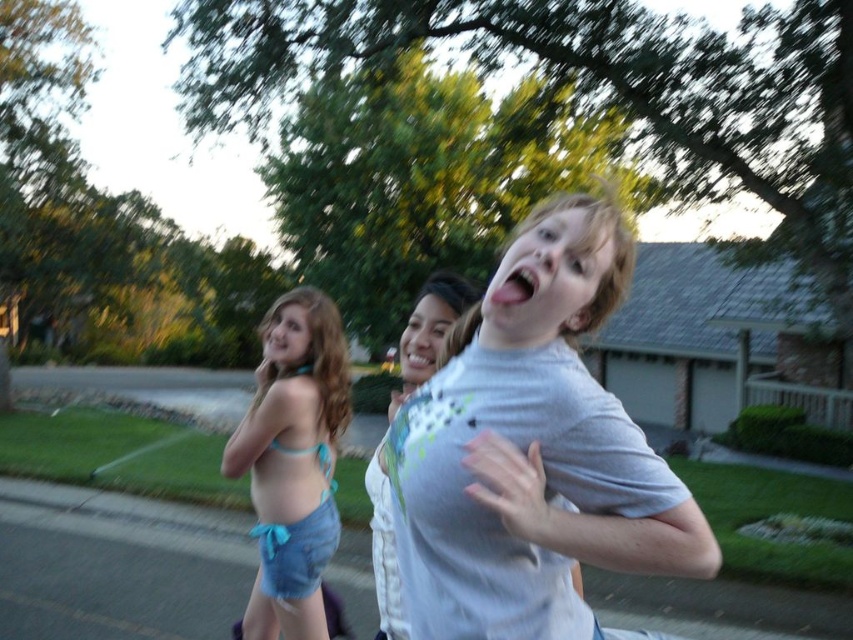
Question: Is denim shorts at left further to camera compared to white textured shirt at center?

Choices:
 (A) no
 (B) yes

Answer: (B)

Question: Is denim shorts at left to the right of white textured shirt at center from the viewer's perspective?

Choices:
 (A) no
 (B) yes

Answer: (A)

Question: Can you confirm if denim shorts at left is smaller than white textured shirt at center?

Choices:
 (A) yes
 (B) no

Answer: (A)

Question: Among these objects, which one is nearest to the camera?

Choices:
 (A) white matte t-shirt at center
 (B) denim shorts at left

Answer: (A)

Question: Which point is closer to the camera taking this photo?

Choices:
 (A) (514, 474)
 (B) (311, 557)
 (C) (422, 298)

Answer: (A)

Question: Which of these objects is positioned closest to the denim shorts at left?

Choices:
 (A) white textured shirt at center
 (B) white matte t-shirt at center

Answer: (A)